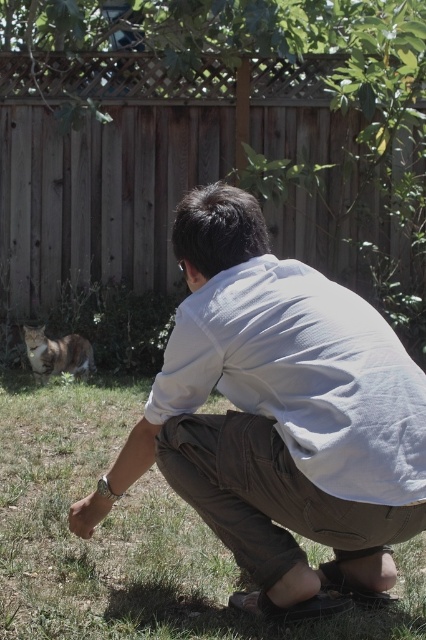
You are a photographer standing at the edge of the scene. You need to take a photo that includes both the white cotton shirt at center and the tabby fur cat at lower left. Which object should you focus on first to ensure both are in frame?

You should focus on the white cotton shirt at center first because it is closer to the viewer than the tabby fur cat at lower left, so adjusting the camera to include it will naturally bring the cat into the frame as well.

You are standing in a backyard garden and see a person crouching on the grass at point (186, 314). You want to approach them without disturbing them. If you move forward 2 meters, will you be closer than 1 meter to the person?

The distance between you and the person at point (186, 314) is 2.87 meters. If you move forward 2 meters, you will be 0.87 meters away, which is less than 1 meter. Therefore, you will be closer than 1 meter to the person.